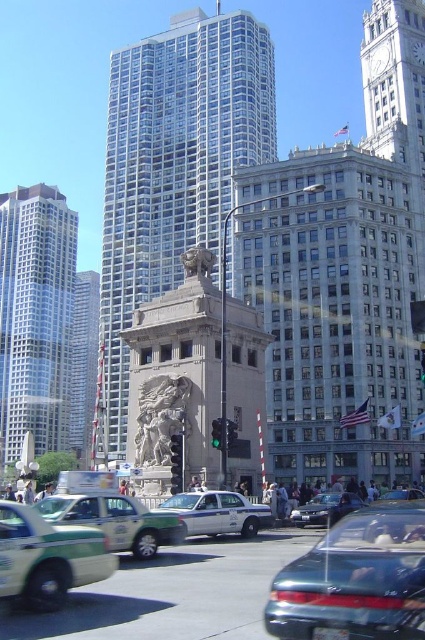
Question: Which object is positioned farthest from the glassy reflective skyscraper at center-left?

Choices:
 (A) glassy steel skyscraper at center
 (B) polished bronze statue at center

Answer: (B)

Question: Where is metallic dark green sedan at center located in relation to shiny silver sedan at center in the image?

Choices:
 (A) right
 (B) left

Answer: (B)

Question: Is glassy reflective skyscraper at center-left positioned before white glossy taxi at center?

Choices:
 (A) yes
 (B) no

Answer: (B)

Question: Does glassy reflective skyscraper at center-left appear under polished bronze statue at center?

Choices:
 (A) no
 (B) yes

Answer: (B)

Question: Which point is farther from the camera taking this photo?

Choices:
 (A) (382, 516)
 (B) (167, 346)
 (C) (11, 282)
 (D) (45, 529)

Answer: (C)

Question: Which object is positioned farthest from the glassy reflective skyscraper at center-left?

Choices:
 (A) glassy steel skyscraper at center
 (B) gray stone lion statue at center
 (C) shiny silver sedan at center
 (D) glassy silver skyscraper at left

Answer: (C)